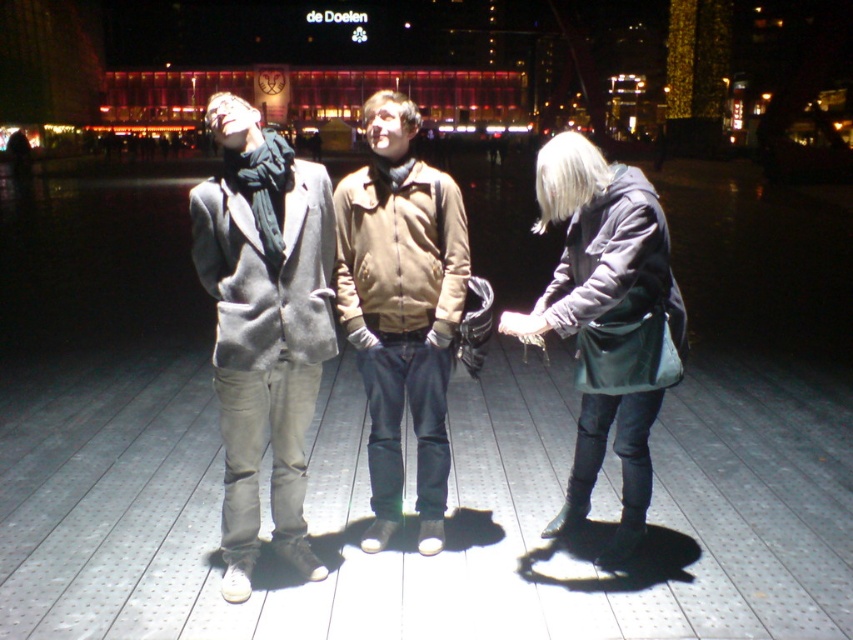
Question: Can you confirm if matte gray coat at center is positioned above beige fabric jacket at center?

Choices:
 (A) no
 (B) yes

Answer: (B)

Question: Which of the following is the closest to the observer?

Choices:
 (A) (428, 273)
 (B) (637, 330)
 (C) (460, 301)

Answer: (B)

Question: Is matte gray coat at center below gray woolen coat at center?

Choices:
 (A) no
 (B) yes

Answer: (B)

Question: Which object is the farthest from the matte gray coat at center?

Choices:
 (A) matte black jacket at right
 (B) beige fabric jacket at center

Answer: (A)

Question: Does gray woolen coat at center have a larger size compared to beige fabric jacket at center?

Choices:
 (A) yes
 (B) no

Answer: (A)

Question: Which point is closer to the camera?

Choices:
 (A) (221, 145)
 (B) (241, 384)

Answer: (A)